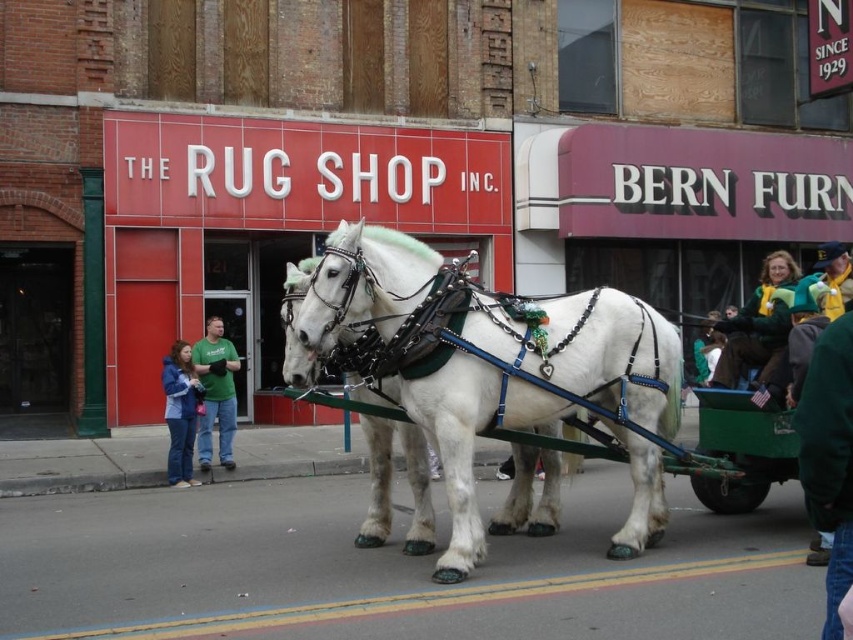
Between point (846, 330) and point (184, 449), which one is positioned in front?

Point (846, 330) is in front.

How far apart are green fuzzy jacket at lower right and blue denim jeans at center?

green fuzzy jacket at lower right and blue denim jeans at center are 9.30 meters apart from each other.

Image resolution: width=853 pixels, height=640 pixels. I want to click on green fuzzy jacket at lower right, so click(828, 456).

Can you confirm if white glossy horse at center is thinner than green cotton shirt at center?

Incorrect, white glossy horse at center's width is not less than green cotton shirt at center's.

Can you confirm if white glossy horse at center is positioned to the right of green cotton shirt at center?

Indeed, white glossy horse at center is positioned on the right side of green cotton shirt at center.

Which is in front, point (486, 323) or point (229, 465)?

Positioned in front is point (486, 323).

You are a GUI agent. You are given a task and a screenshot of the screen. Output one action in this format:
    pyautogui.click(x=<x>, y=<y>)
    Task: Click on the white glossy horse at center
    The image size is (853, 640).
    Given the screenshot: What is the action you would take?
    pyautogui.click(x=488, y=356)

Which is more to the left, green fuzzy jacket at lower right or green cotton shirt at center?

green cotton shirt at center

In the scene shown: Between green fuzzy jacket at lower right and green cotton shirt at center, which one has less height?

green fuzzy jacket at lower right

Which is in front, point (838, 358) or point (227, 452)?

Point (838, 358) is in front.

I want to click on green fuzzy jacket at lower right, so click(x=828, y=456).